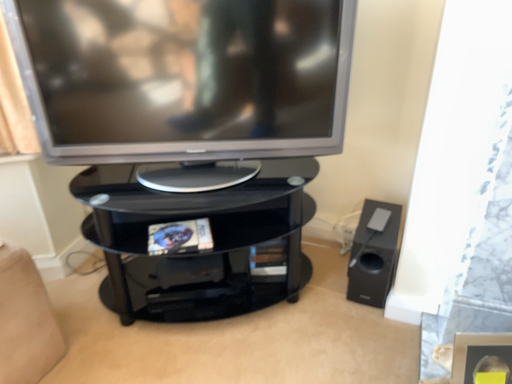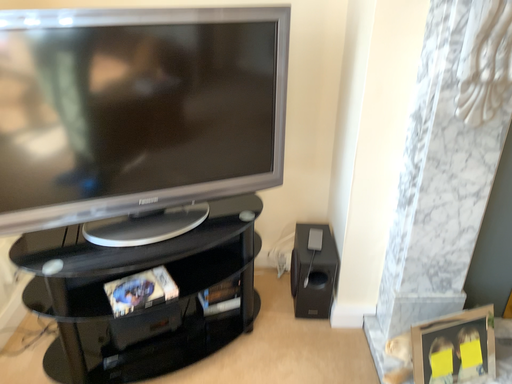
Question: Which way did the camera rotate in the video?

Choices:
 (A) rotated right
 (B) rotated left

Answer: (A)